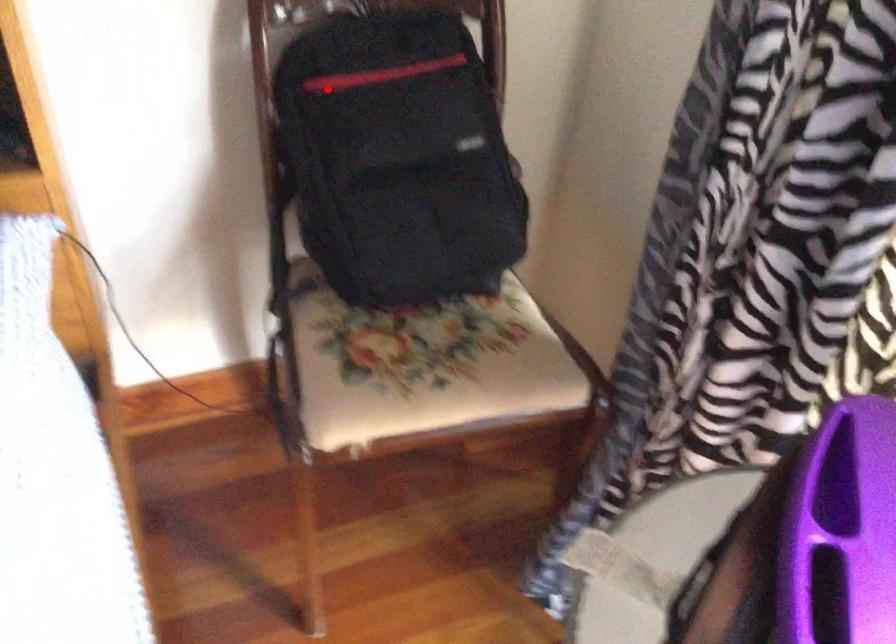
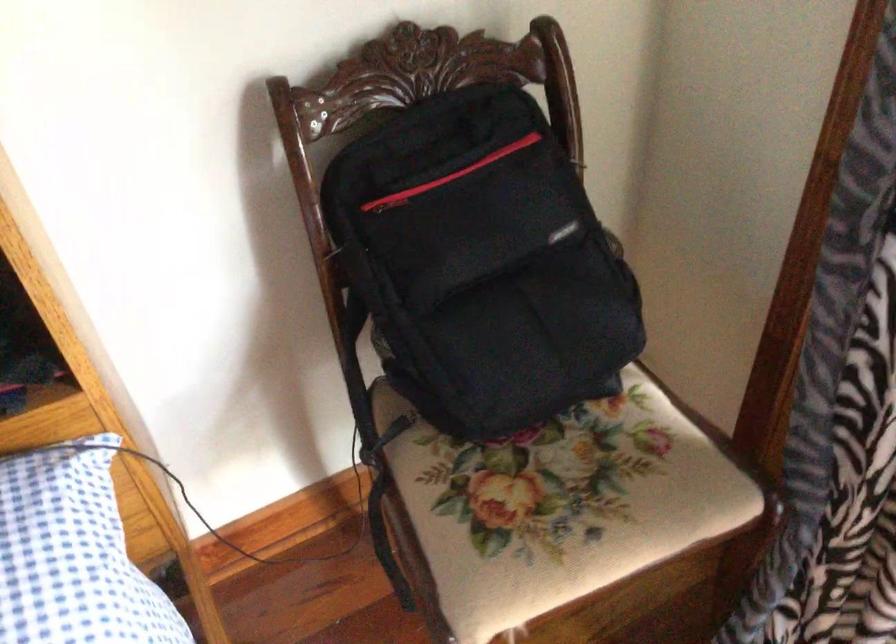
Where in the second image is the point corresponding to the highlighted location from the first image?

(389, 202)